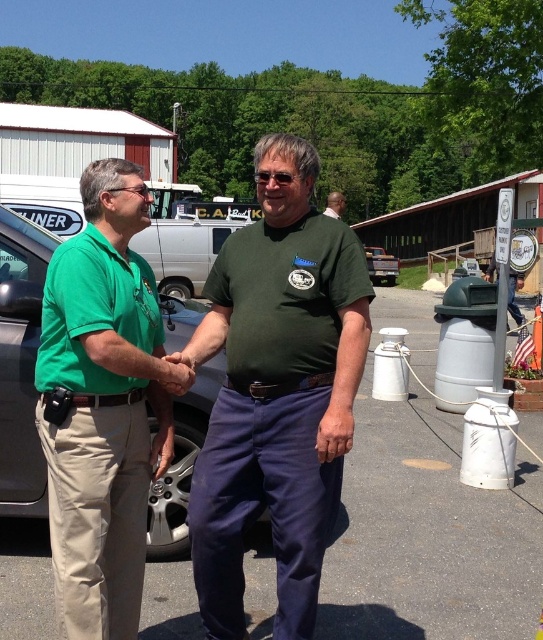
Question: Which point is farther from the camera taking this photo?

Choices:
 (A) (332, 193)
 (B) (71, 492)
 (C) (340, 268)

Answer: (A)

Question: Estimate the real-world distances between objects in this image. Which object is farther from the green shirt at center?

Choices:
 (A) khaki pants at left
 (B) brushed metal truck at center

Answer: (B)

Question: Is brushed metal truck at center smaller than green shirt at center?

Choices:
 (A) yes
 (B) no

Answer: (A)

Question: Which object appears farthest from the camera in this image?

Choices:
 (A) khaki pants at left
 (B) green shirt at center

Answer: (B)

Question: Can you confirm if green cotton shirt at center is positioned below brushed metal truck at center?

Choices:
 (A) no
 (B) yes

Answer: (B)

Question: Is brushed metal truck at center thinner than green shirt at center?

Choices:
 (A) yes
 (B) no

Answer: (A)